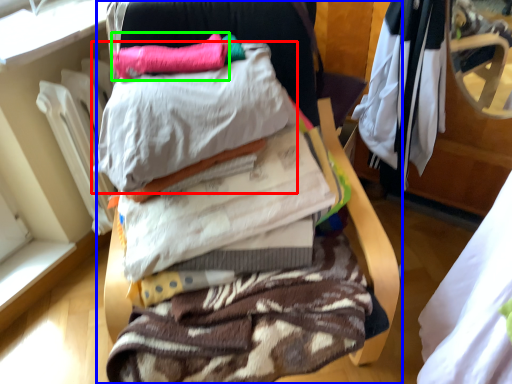
Question: Which object is positioned closest to pillow (highlighted by a red box)? Select from furniture (highlighted by a blue box) and pillow (highlighted by a green box).

Choices:
 (A) furniture
 (B) pillow

Answer: (B)